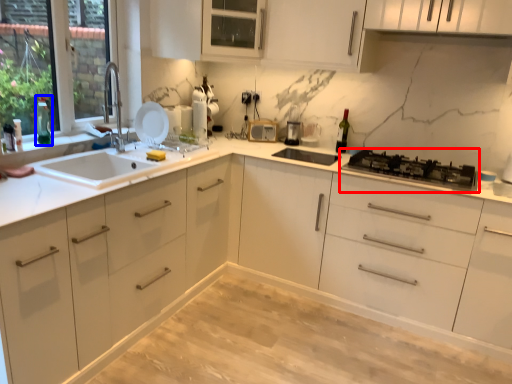
Question: Which of the following is the farthest to the observer, gas stove (highlighted by a red box) or bottle (highlighted by a blue box)?

Choices:
 (A) gas stove
 (B) bottle

Answer: (B)